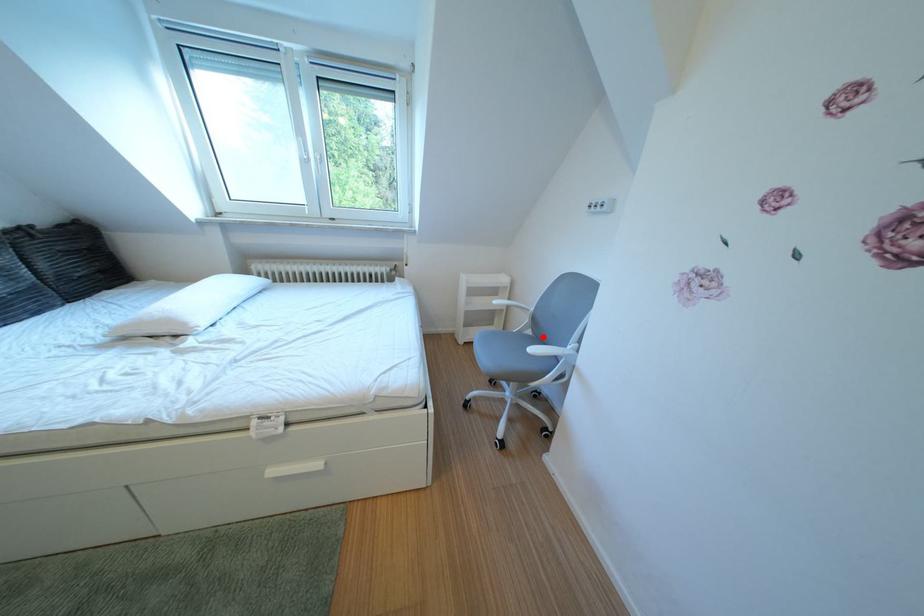
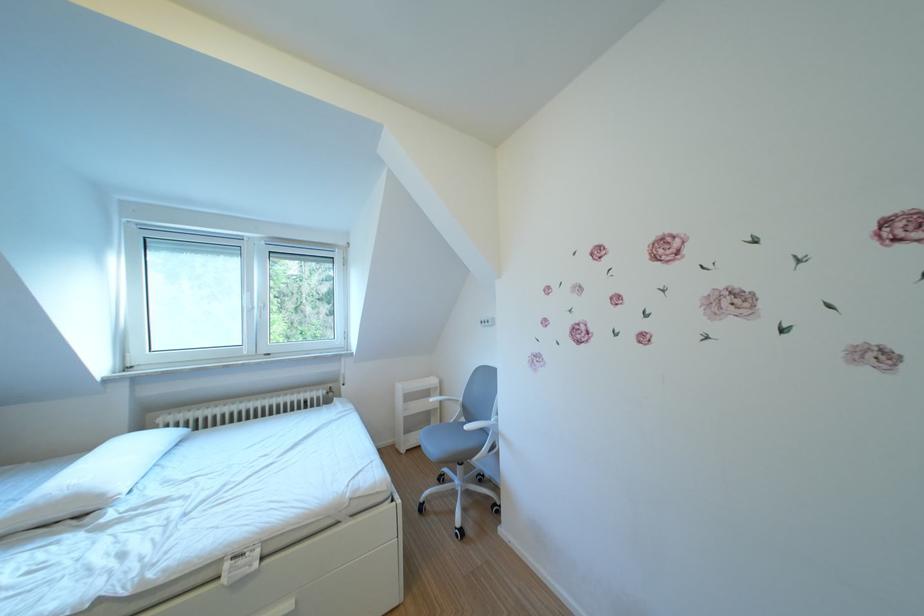
Question: I am providing you with two images of the same scene from different viewpoints. In image1, a red point is highlighted. Considering the same 3D point in image2, which of the following is correct?

Choices:
 (A) It is closer
 (B) It is farther

Answer: (B)